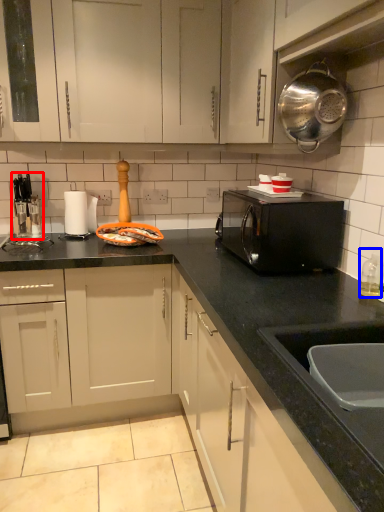
Question: Which object is closer to the camera taking this photo, appliance (highlighted by a red box) or bottle (highlighted by a blue box)?

Choices:
 (A) appliance
 (B) bottle

Answer: (B)